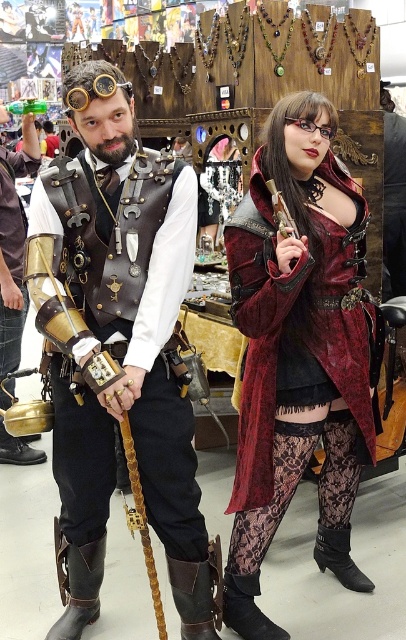
Question: Which object appears closest to the camera in this image?

Choices:
 (A) matte gold armor at left
 (B) leather boot at lower center

Answer: (B)

Question: Among these points, which one is farthest from the camera?

Choices:
 (A) (278, 634)
 (B) (15, 225)
 (C) (211, 593)

Answer: (B)

Question: Is leather boot at lower center to the left of black suede boot at lower right from the viewer's perspective?

Choices:
 (A) no
 (B) yes

Answer: (B)

Question: Estimate the real-world distances between objects in this image. Which object is farther from the black leather boot at lower center?

Choices:
 (A) leather vest at center
 (B) leather boot at lower center
 (C) velvet maroon coat at center

Answer: (A)

Question: Where is velvet maroon coat at center located in relation to brown leather boot at lower left in the image?

Choices:
 (A) left
 (B) right

Answer: (B)

Question: Is matte gold armor at left behind brown leather boot at lower left?

Choices:
 (A) yes
 (B) no

Answer: (A)